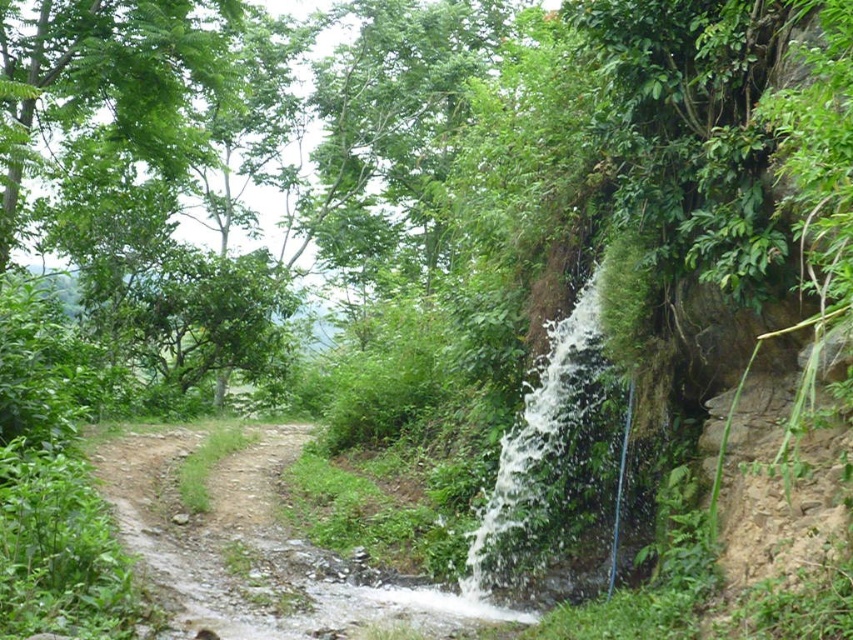
You are standing at point (228, 140) in the forest. What do you see around you?

At point (228, 140) lies green leafy tree at upper left.

What is the 2D coordinate of the green leafy tree at upper left in the image?

The green leafy tree at upper left is located at the 2D coordinate point of (x=228, y=140).

You are an environmental scientist assessing the forest canopy. You observe the green leafy tree at upper left and the white frothy water at right. Which object has a greater horizontal spread in the image?

The green leafy tree at upper left has a greater horizontal spread than the white frothy water at right, as its width is larger according to the description.